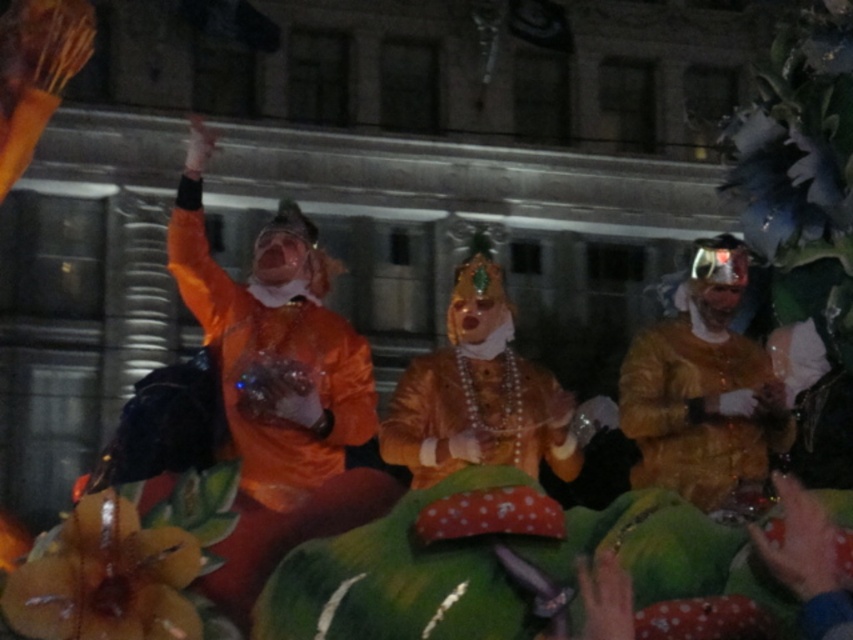
You are a photographer standing at the back of the scene. You want to take a photo of the gold satin mask at center and the gold shiny fabric at right without moving the performers. Can you fit both objects in your camera frame if your camera has a maximum horizontal field of view of 3 meters?

The distance between the gold satin mask at center and the gold shiny fabric at right is 3.49 meters, which exceeds the camera frame of 3 meters. Therefore, both objects cannot be captured in a single frame without moving the performers.

Consider the image. You are a photographer at the event and want to capture both the gold satin mask at center and the gold shiny fabric at right in the same frame. Based on their positions, which object should you focus on first to ensure both are in the frame?

The gold satin mask at center is positioned on the left side of gold shiny fabric at right, so you should focus on the gold shiny fabric at right first to ensure both are in the frame.